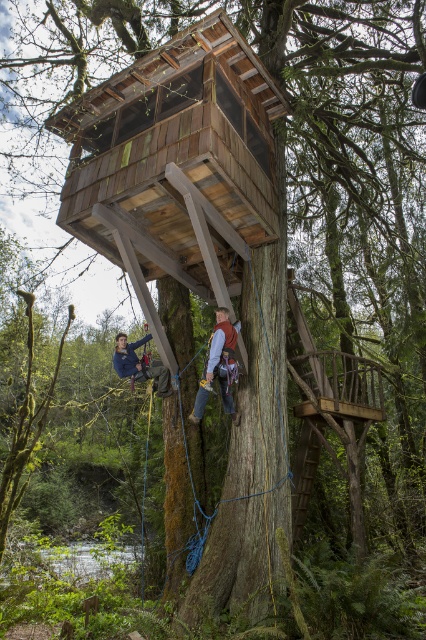
You are a safety inspector checking the treehouse construction site. You notice the brown leather harness at center and the blue denim jacket at center. Which object is closer to the inspector from the perspective shown in the image?

The brown leather harness at center is closer to the inspector because it is in front of the blue denim jacket at center in the image.

You are planning to hang a decorative wreath between the brown leather harness at center and the blue denim jacket at center. Since both are at the center, which object should you place the wreath closer to to ensure it balances the visual weight?

The brown leather harness at center is bigger than the blue denim jacket at center, so placing the wreath closer to the blue denim jacket at center will balance the visual weight.